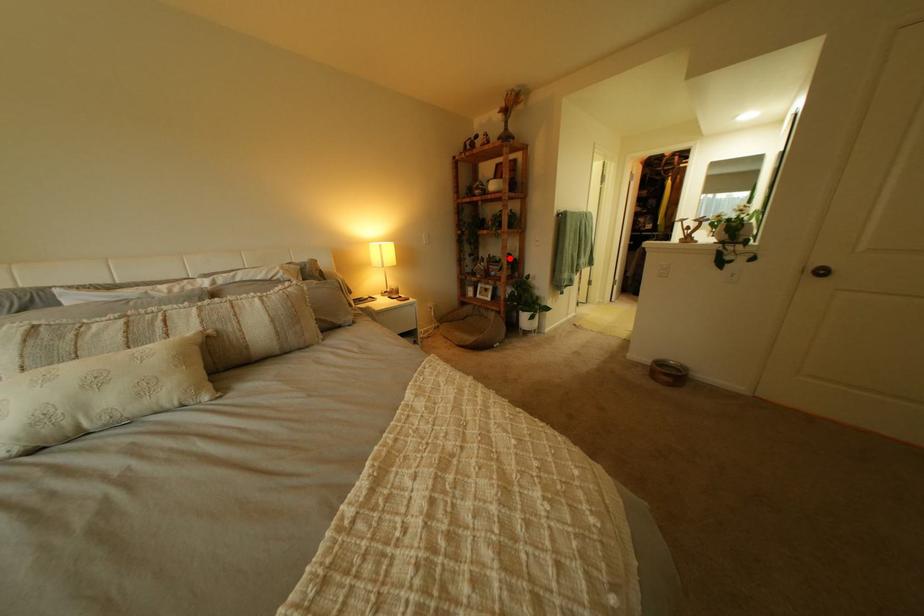
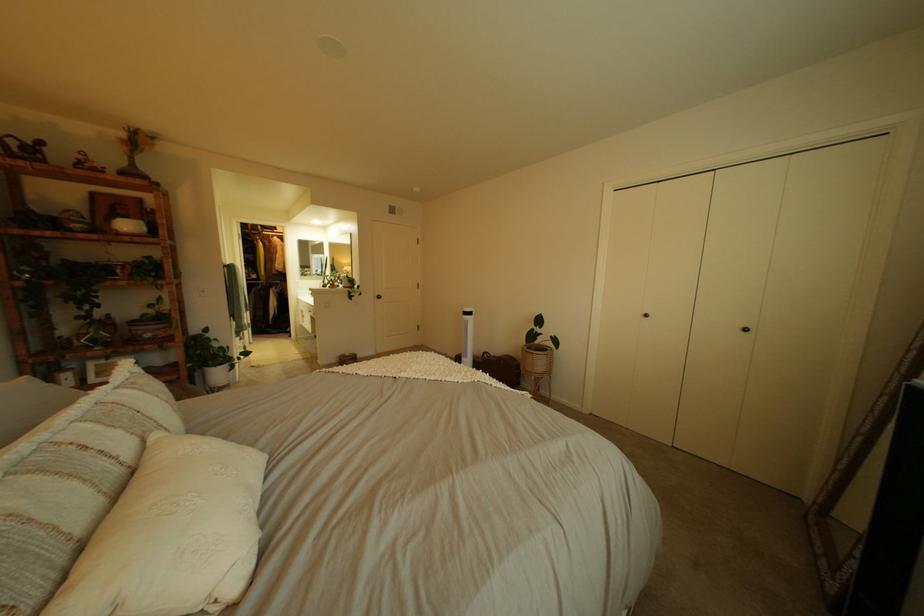
Question: I am providing you with two images of the same scene from different viewpoints. A red point is shown in image1. For the corresponding object point in image2, is it positioned nearer or farther from the camera?

Choices:
 (A) Nearer
 (B) Farther

Answer: (B)